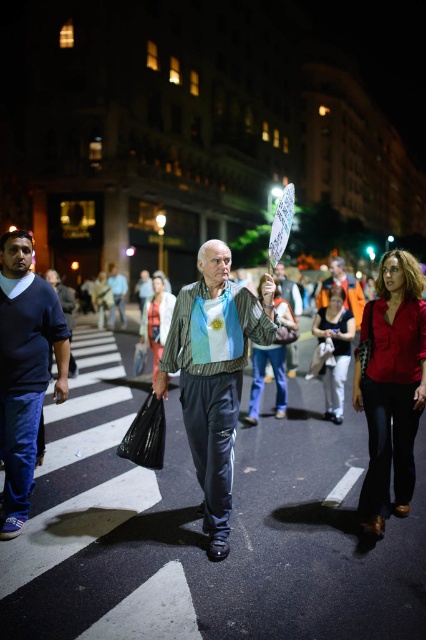
You are a photographer trying to capture the protester in the center of the image. The orange fabric shirt at center and the white paper sign at center are both in your frame. Which object is narrower when viewed from your camera angle?

The orange fabric shirt at center is thinner than the white paper sign at center, so the orange fabric shirt at center is narrower.

You are a photographer trying to capture the protest scene. You notice the striped fabric shirt at center and the dark blue sweater at left. Which clothing item is closer to the camera based on their positions?

The striped fabric shirt at center is positioned under the dark blue sweater at left, meaning the dark blue sweater at left is closer to the camera.

Based on the photo, you are a photographer trying to capture the protest scene. You notice two people in the crowd wearing a striped fabric shirt at center and a dark blue sweater at left. Which one is positioned closer to the front of the image?

The striped fabric shirt at center is closer to the viewer than the dark blue sweater at left, so the person wearing the striped fabric shirt at center is positioned closer to the front of the image.